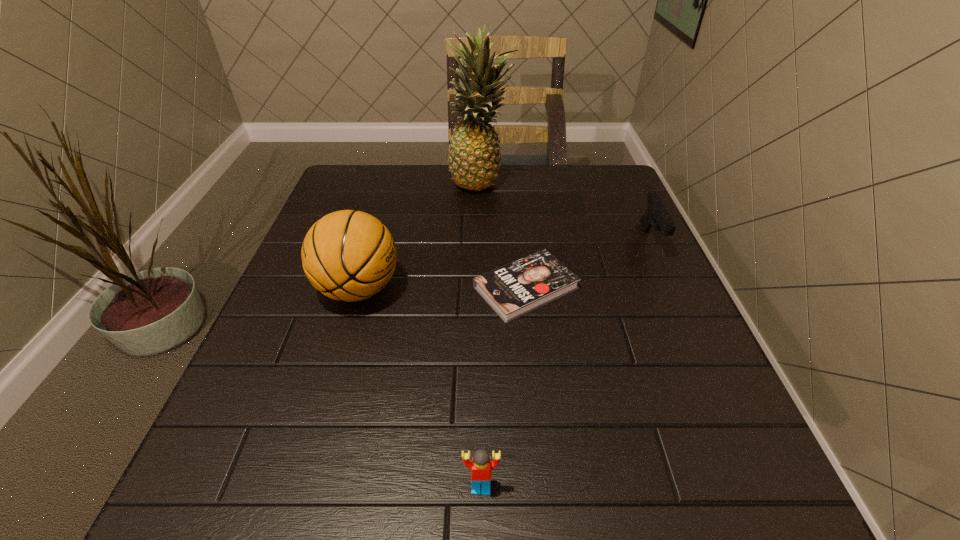
Locate an element on the screen. free region at the far right corner of the desktop is located at coordinates (589, 169).

At what (x,y) coordinates should I click in order to perform the action: click on empty location between the farthest object and the pistol. Please return your answer as a coordinate pair (x, y). The height and width of the screenshot is (540, 960). Looking at the image, I should click on (x=566, y=211).

The height and width of the screenshot is (540, 960). What are the coordinates of `free point between the leftmost object and the Lego` in the screenshot? It's located at coord(420,388).

Where is `free space between the Lego and the leftmost object`? Image resolution: width=960 pixels, height=540 pixels. free space between the Lego and the leftmost object is located at coordinates (420, 388).

What are the coordinates of `vacant area that lies between the Lego and the book` in the screenshot? It's located at (504, 388).

Where is `free spot between the pineapple and the basketball`? free spot between the pineapple and the basketball is located at coordinates (420, 235).

In order to click on unoccupied area between the leftmost object and the book in this screenshot , I will do `click(443, 289)`.

You are a GUI agent. You are given a task and a screenshot of the screen. Output one action in this format:
    pyautogui.click(x=<x>, y=<y>)
    Task: Click on the vacant region between the rightmost object and the shortest object
    The image size is (960, 540).
    Given the screenshot: What is the action you would take?
    pyautogui.click(x=588, y=265)

Find the location of a particular element. vacant area between the nearest object and the basketball is located at coordinates (420, 388).

This screenshot has width=960, height=540. I want to click on empty space between the farthest object and the Lego, so click(481, 334).